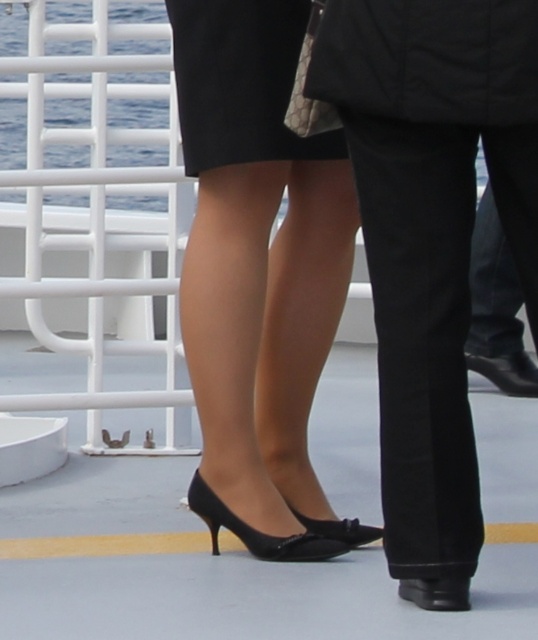
Is point (220, 420) more distant than point (194, 134)?

That is True.

Between black patent leather high heels at center and black satin dress at center, which one is positioned higher?

black satin dress at center is higher up.

Is point (253, 321) behind point (303, 147)?

Yes, point (253, 321) is behind point (303, 147).

Where is `black patent leather high heels at center`? black patent leather high heels at center is located at coordinates (258, 275).

Is black smooth pants at right wider than black leather shoe at lower center?

Correct, the width of black smooth pants at right exceeds that of black leather shoe at lower center.

Does point (485, 4) come behind point (424, 580)?

No, it is not.

Image resolution: width=538 pixels, height=640 pixels. Find the location of `black smooth pants at right`. black smooth pants at right is located at coordinates (431, 230).

Which of these two, black patent leather heels at center or black leather shoe at lower center, stands taller?

With more height is black patent leather heels at center.

Is black patent leather heels at center bigger than black leather shoe at lower center?

Indeed, black patent leather heels at center has a larger size compared to black leather shoe at lower center.

Is point (197, 490) positioned after point (463, 609)?

Yes.

Identify the location of black patent leather heels at center. The image size is (538, 640). (258, 531).